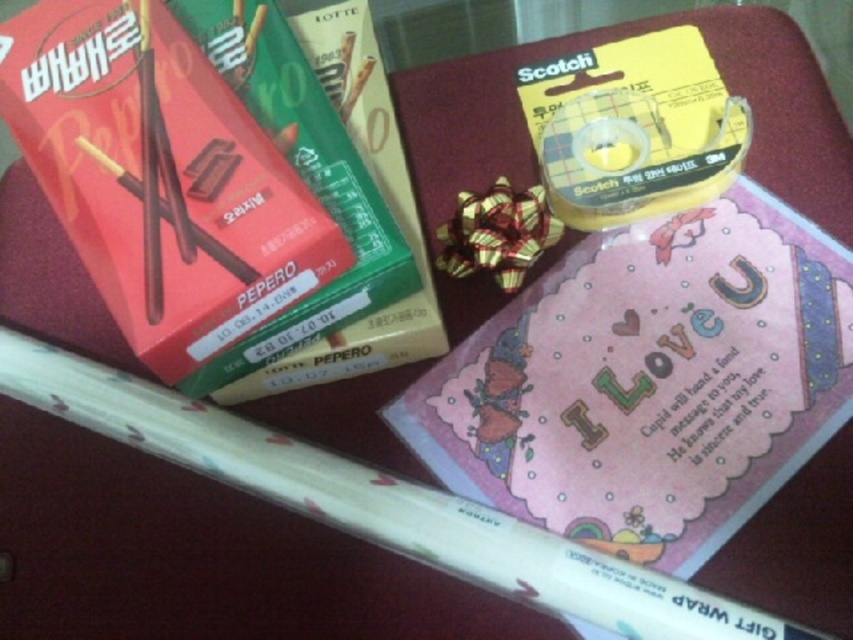
Based on the provided scene description, where is the pink paper card at upper center located in the image?

The pink paper card at upper center is located at point coordinates of (x=648, y=381).

You are organizing a gift set and need to place the pink paper card at upper center and the matte red box at upper left into a rectangular box. Which object should you place first to ensure both fit properly?

The pink paper card at upper center might be wider than the matte red box at upper left, so you should place the wider object first to ensure proper fitting.

You are looking at the arrangement of items on the table. There are two points marked on the table surface. One is at point [802,284] and the other is at point [262,112]. Which of these two points is closer to you?

Point [802,284] is further to the camera than point [262,112], so the point closer to you is point [262,112].